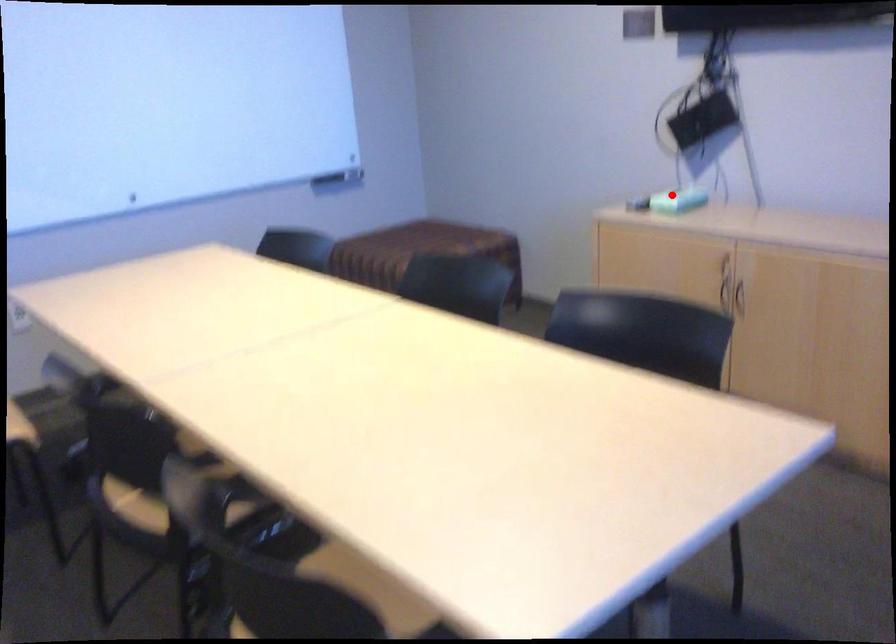
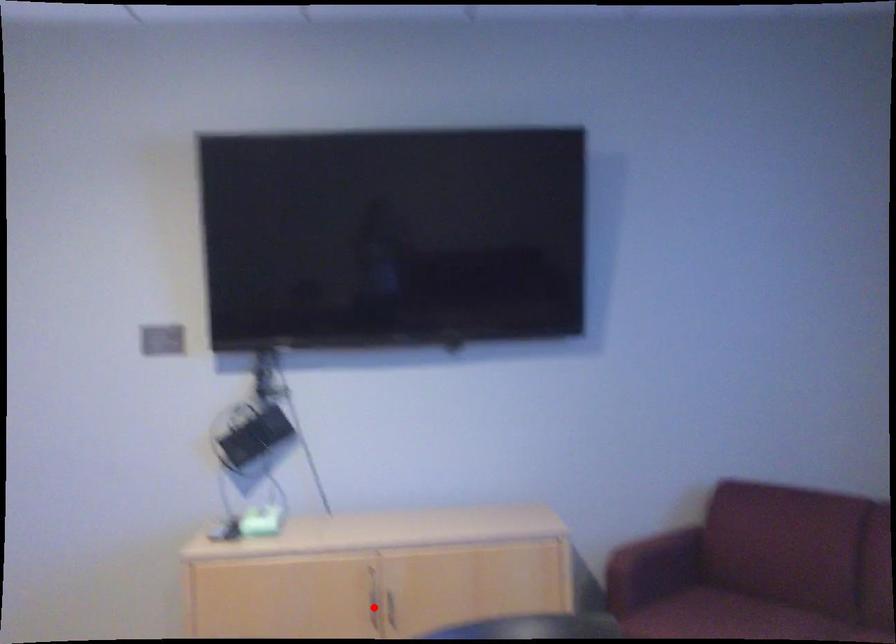
I am providing you with two images of the same scene from different viewpoints. A red point is marked on the first image and another point is marked on the second image. Is the marked point in image1 the same physical position as the marked point in image2?

No